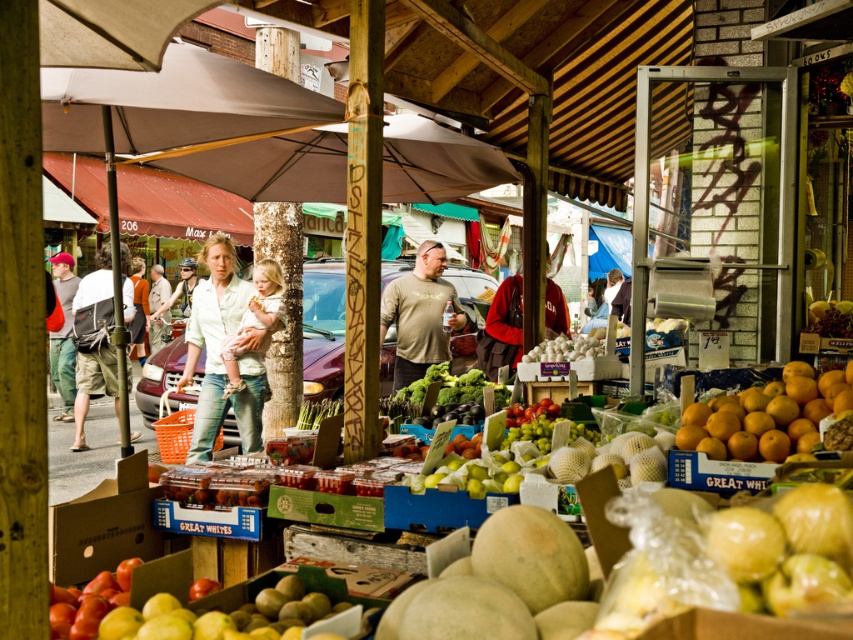
Is point (838, 630) less distant than point (233, 282)?

That is True.

Does shiny plastic fruits at center have a larger size compared to light beige denim jeans at center?

Actually, shiny plastic fruits at center might be smaller than light beige denim jeans at center.

This screenshot has width=853, height=640. What do you see at coordinates (782, 545) in the screenshot? I see `shiny plastic fruits at center` at bounding box center [782, 545].

Image resolution: width=853 pixels, height=640 pixels. Find the location of `shiny plastic fruits at center`. shiny plastic fruits at center is located at coordinates (782, 545).

Is light beige denim jeans at center to the left of matte khaki shorts at left from the viewer's perspective?

No, light beige denim jeans at center is not to the left of matte khaki shorts at left.

Is point (206, 326) closer to camera compared to point (114, 385)?

Yes, point (206, 326) is in front of point (114, 385).

Locate an element on the screen. Image resolution: width=853 pixels, height=640 pixels. light beige denim jeans at center is located at coordinates (218, 353).

Locate an element on the screen. The height and width of the screenshot is (640, 853). light beige denim jeans at center is located at coordinates (218, 353).

Can you confirm if brown fabric umbrella at upper center is wider than shiny plastic fruits at center?

Yes, brown fabric umbrella at upper center is wider than shiny plastic fruits at center.

Which of these two, brown fabric umbrella at upper center or shiny plastic fruits at center, stands shorter?

Standing shorter between the two is shiny plastic fruits at center.

Locate an element on the screen. The width and height of the screenshot is (853, 640). brown fabric umbrella at upper center is located at coordinates (169, 109).